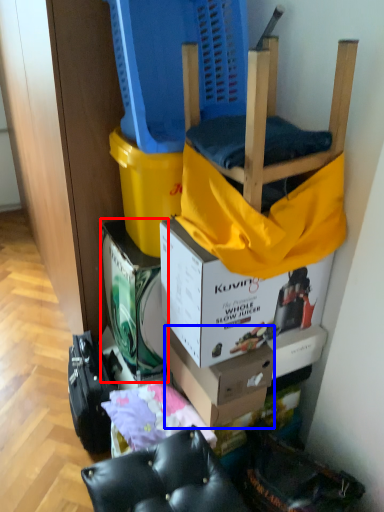
Question: Which point is further to the camera, box (highlighted by a red box) or box (highlighted by a blue box)?

Choices:
 (A) box
 (B) box

Answer: (A)